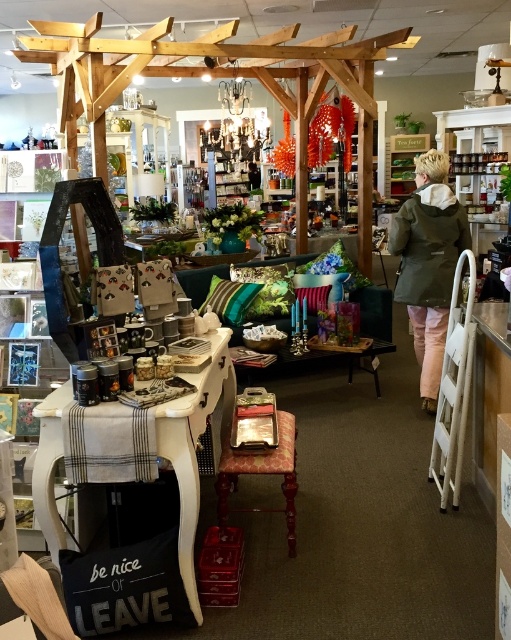
Question: Does green matte jacket at upper right appear on the left side of wooden stool at center?

Choices:
 (A) no
 (B) yes

Answer: (A)

Question: Which of the following is the closest to the observer?

Choices:
 (A) (248, 456)
 (B) (429, 253)

Answer: (A)

Question: Which object is positioned farthest from the green velvet pillow at center?

Choices:
 (A) green matte jacket at upper right
 (B) wooden stool at center

Answer: (B)

Question: Is wooden stool at center to the right of green velvet pillow at center from the viewer's perspective?

Choices:
 (A) no
 (B) yes

Answer: (B)

Question: Can you confirm if green matte jacket at upper right is positioned below green velvet pillow at center?

Choices:
 (A) no
 (B) yes

Answer: (A)

Question: Which point is farther to the camera?

Choices:
 (A) green matte jacket at upper right
 (B) wooden stool at center

Answer: (A)